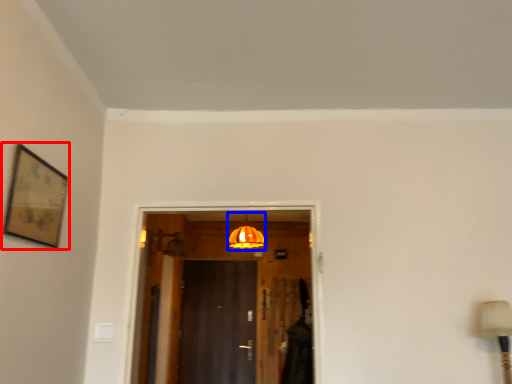
Question: Which object is further to the camera taking this photo, picture frame (highlighted by a red box) or light fixture (highlighted by a blue box)?

Choices:
 (A) picture frame
 (B) light fixture

Answer: (B)